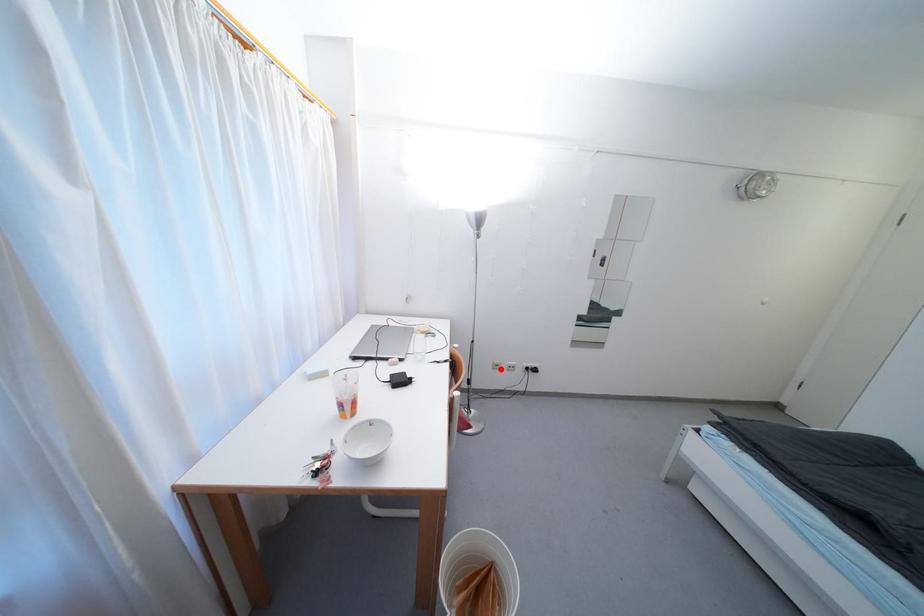
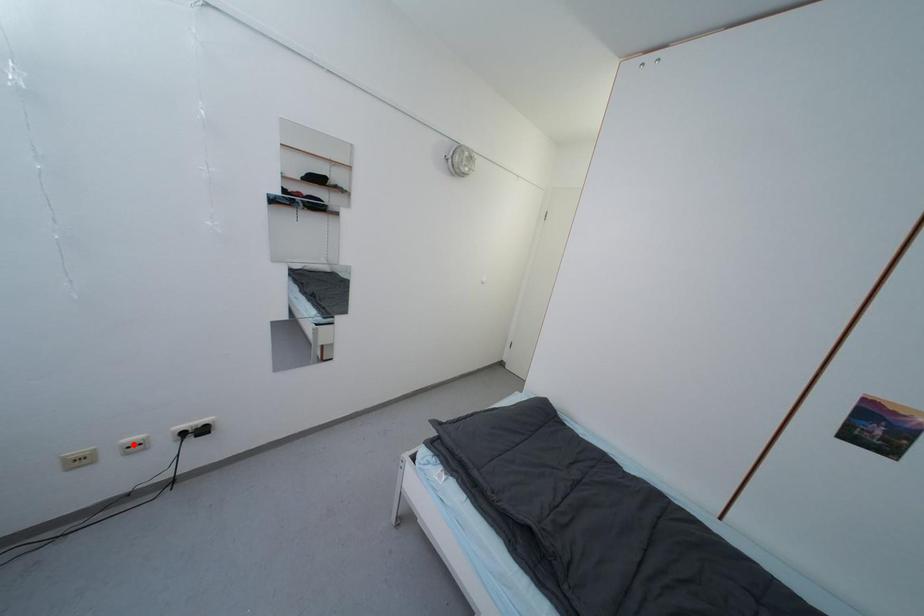
Based on the photo, I am providing you with two images of the same scene from different viewpoints. A red point is marked on the first image and another point is marked on the second image. Are the points marked in image1 and image2 representing the same 3D position?

No